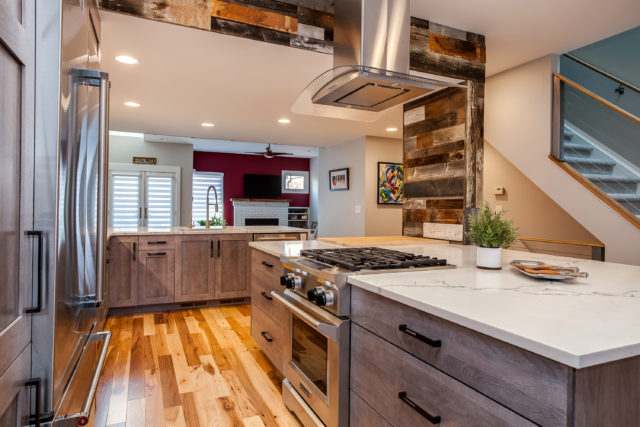
Where is `wall art`? The image size is (640, 427). wall art is located at coordinates 145,160, 292,183, 342,180, 388,182.